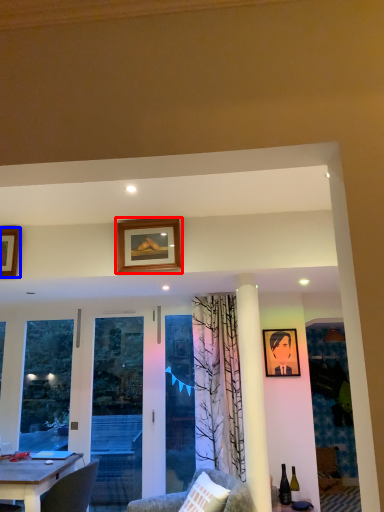
Question: Which of the following is the closest to the observer, picture frame (highlighted by a red box) or picture frame (highlighted by a blue box)?

Choices:
 (A) picture frame
 (B) picture frame

Answer: (A)